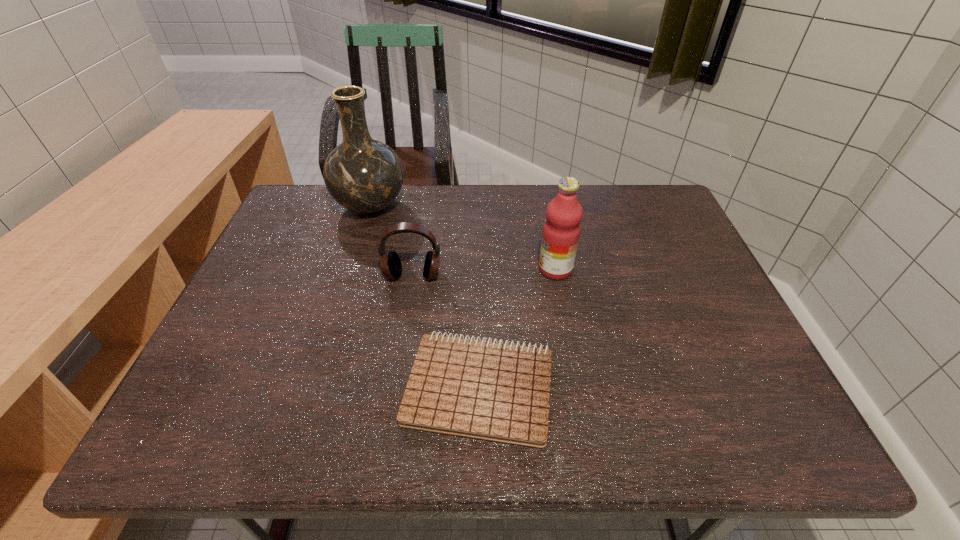
Locate an element on the screen. vacant space located on the label of the third shortest object is located at coordinates (512, 269).

Find the location of a particular element. blank space located on the ear pads of the headset is located at coordinates (394, 399).

The width and height of the screenshot is (960, 540). Identify the location of vacant space located 0.360m on the back of the notebook. (479, 237).

You are a GUI agent. You are given a task and a screenshot of the screen. Output one action in this format:
    pyautogui.click(x=<x>, y=<y>)
    Task: Click on the object that is at the far edge
    This screenshot has width=960, height=540.
    Given the screenshot: What is the action you would take?
    pyautogui.click(x=364, y=175)

This screenshot has width=960, height=540. In order to click on object that is at the near edge in this screenshot , I will do `click(492, 391)`.

In order to click on object present at the left edge in this screenshot , I will do `click(364, 175)`.

In order to click on object at the far left corner in this screenshot , I will do `click(364, 175)`.

In the image, there is a desktop. Identify the location of free space at the far edge. The image size is (960, 540). point(442,196).

In the image, there is a desktop. At what (x,y) coordinates should I click in order to perform the action: click on free space at the near edge. Please return your answer as a coordinate pair (x, y). The height and width of the screenshot is (540, 960). Looking at the image, I should click on (579, 437).

The image size is (960, 540). Identify the location of vacant space at the left edge of the desktop. (228, 375).